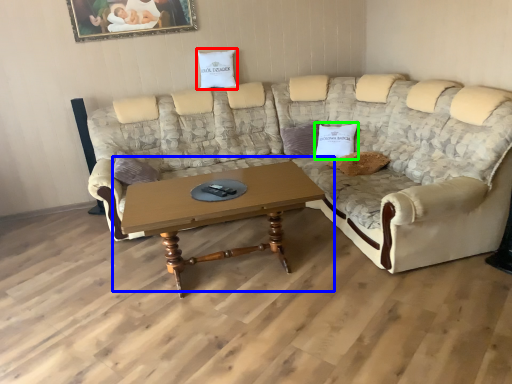
Question: Considering the real-world distances, which object is farthest from pillow (highlighted by a red box)? coffee table (highlighted by a blue box) or pillow (highlighted by a green box)?

Choices:
 (A) coffee table
 (B) pillow

Answer: (A)